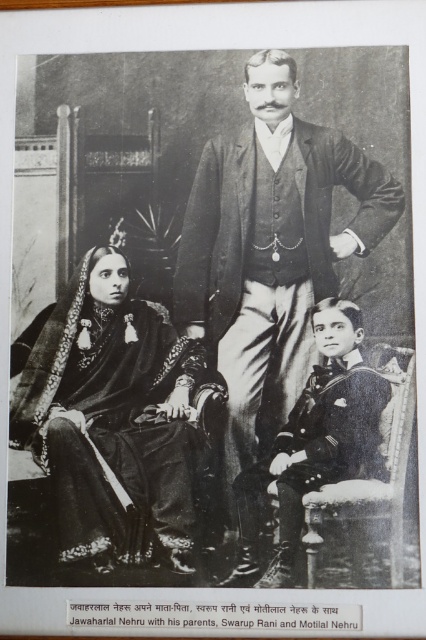
Is point (252, 268) less distant than point (327, 330)?

No, (252, 268) is further to viewer.

Locate an element on the screen. This screenshot has height=640, width=426. smooth black suit at center is located at coordinates (270, 250).

Which is in front, point (100, 321) or point (353, 397)?

Point (353, 397) is in front.

Is velvet black shawl at center shorter than sailor suit at lower right?

In fact, velvet black shawl at center may be taller than sailor suit at lower right.

Is point (22, 429) less distant than point (282, 531)?

That is False.

You are a GUI agent. You are given a task and a screenshot of the screen. Output one action in this format:
    pyautogui.click(x=<x>, y=<y>)
    Task: Click on the velvet black shawl at center
    
    Given the screenshot: What is the action you would take?
    pyautogui.click(x=112, y=417)

Between smooth black suit at center and velvet black shawl at center, which one is positioned higher?

Positioned higher is smooth black suit at center.

This screenshot has width=426, height=640. What do you see at coordinates (270, 250) in the screenshot?
I see `smooth black suit at center` at bounding box center [270, 250].

Based on the photo, measure the distance between smooth black suit at center and camera.

They are 25.47 feet apart.

The width and height of the screenshot is (426, 640). What are the coordinates of `smooth black suit at center` in the screenshot? It's located at (270, 250).